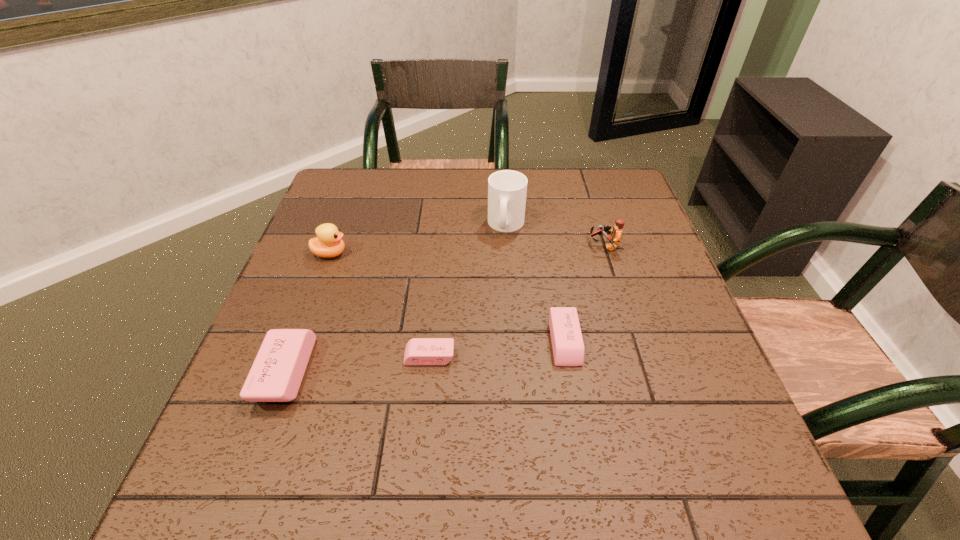
I want to click on the tallest eraser, so click(277, 372).

Image resolution: width=960 pixels, height=540 pixels. I want to click on the leftmost eraser, so click(x=277, y=372).

The height and width of the screenshot is (540, 960). Find the location of `the second eraser from right to left`. the second eraser from right to left is located at coordinates pyautogui.click(x=419, y=351).

Where is `the third object from left to right`? This screenshot has width=960, height=540. the third object from left to right is located at coordinates (419, 351).

The image size is (960, 540). In order to click on the rightmost eraser in this screenshot , I will do `click(567, 343)`.

You are a GUI agent. You are given a task and a screenshot of the screen. Output one action in this format:
    pyautogui.click(x=<x>, y=<y>)
    Task: Click on the fifth tallest object
    This screenshot has width=960, height=540.
    Given the screenshot: What is the action you would take?
    pyautogui.click(x=567, y=343)

The image size is (960, 540). Find the location of `mug`. mug is located at coordinates (507, 189).

At what (x,y) coordinates should I click in order to perform the action: click on the tallest object. Please return your answer as a coordinate pair (x, y). The image size is (960, 540). Looking at the image, I should click on (507, 189).

Identify the location of Lego. (616, 234).

Locate an element on the screen. duckling is located at coordinates (328, 243).